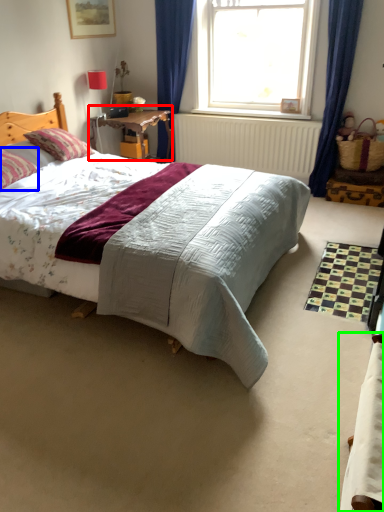
Question: Which object is the farthest from table (highlighted by a red box)? Choose among these: pillow (highlighted by a blue box) or bed (highlighted by a green box).

Choices:
 (A) pillow
 (B) bed

Answer: (B)